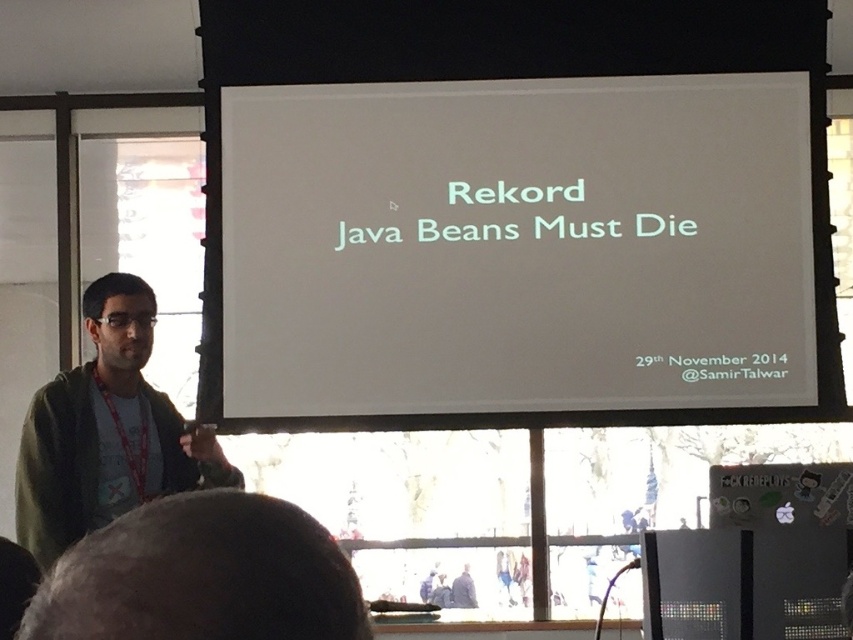
Question: Which point is farther to the camera?

Choices:
 (A) dark green sweater at upper left
 (B) white paper at center

Answer: (B)

Question: Is dark green sweater at upper left wider than green casual shirt at left?

Choices:
 (A) yes
 (B) no

Answer: (B)

Question: Can you confirm if white paper at center is smaller than green casual shirt at left?

Choices:
 (A) no
 (B) yes

Answer: (A)

Question: Based on their relative distances, which object is farther from the green casual shirt at left?

Choices:
 (A) dark green sweater at upper left
 (B) white paper at center

Answer: (A)

Question: Which point is farther to the camera?

Choices:
 (A) white paper at center
 (B) green casual shirt at left
 (C) dark green sweater at upper left

Answer: (A)

Question: Is white paper at center wider than green casual shirt at left?

Choices:
 (A) yes
 (B) no

Answer: (A)